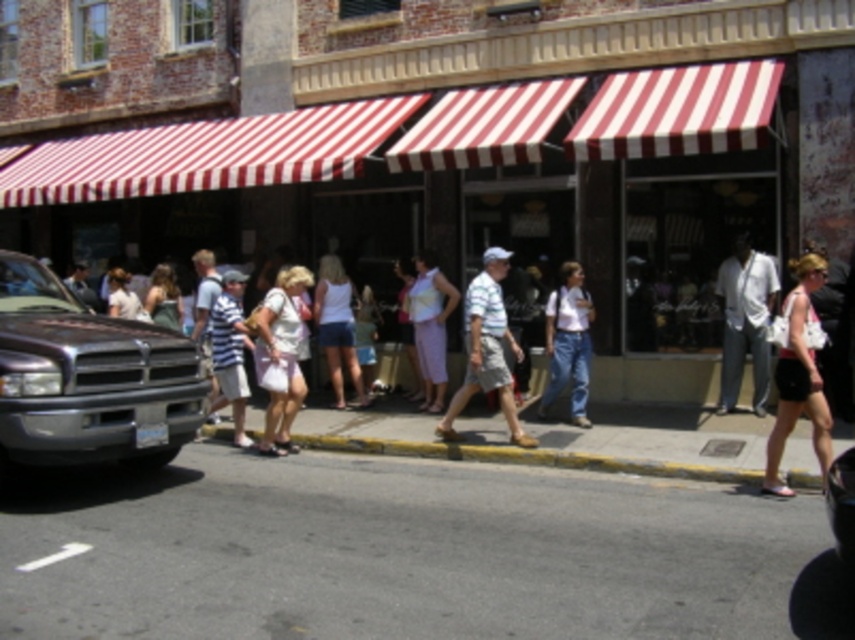
You are standing at the edge of the sidewalk in the street scene. You see a matte white dress at center. If you want to reach the dress, in which direction should you walk relative to the sidewalk?

The matte white dress at center is located at point coordinates of 0.558 on the x axis and 0.330 on the y axis. Since the sidewalk is on the left side of the frame and the dress is at the center, you should walk towards the right along the sidewalk to reach the matte white dress at center.

You are a fashion designer observing the street scene. You notice two white cotton garments in the crowd. Which one has a narrower width between the white cotton shirt at right and the white cotton tank top at center?

The white cotton shirt at right has a narrower width compared to the white cotton tank top at center.